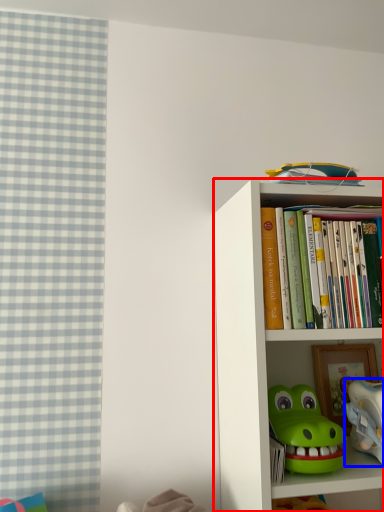
Question: Which object is closer to the camera taking this photo, bookcase (highlighted by a red box) or toy (highlighted by a blue box)?

Choices:
 (A) bookcase
 (B) toy

Answer: (A)